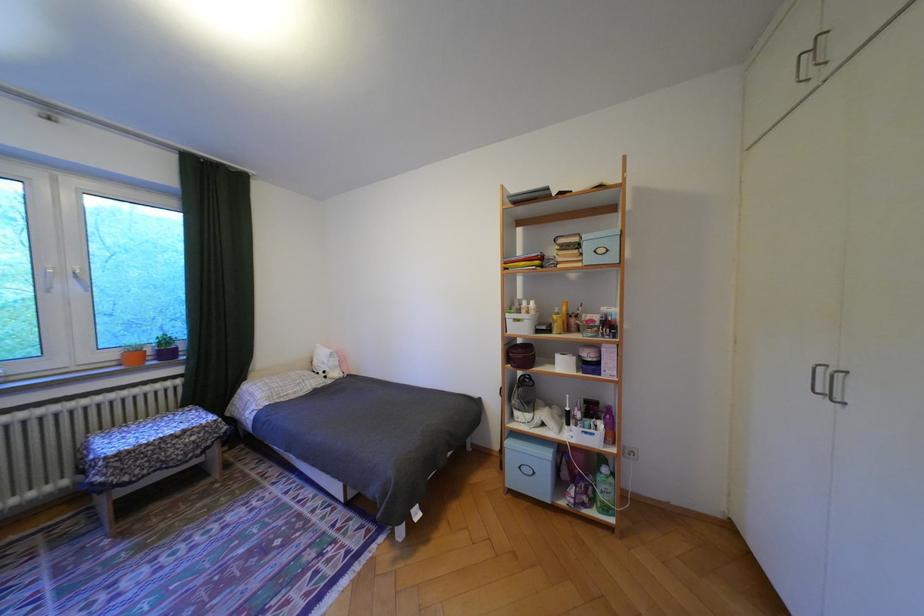
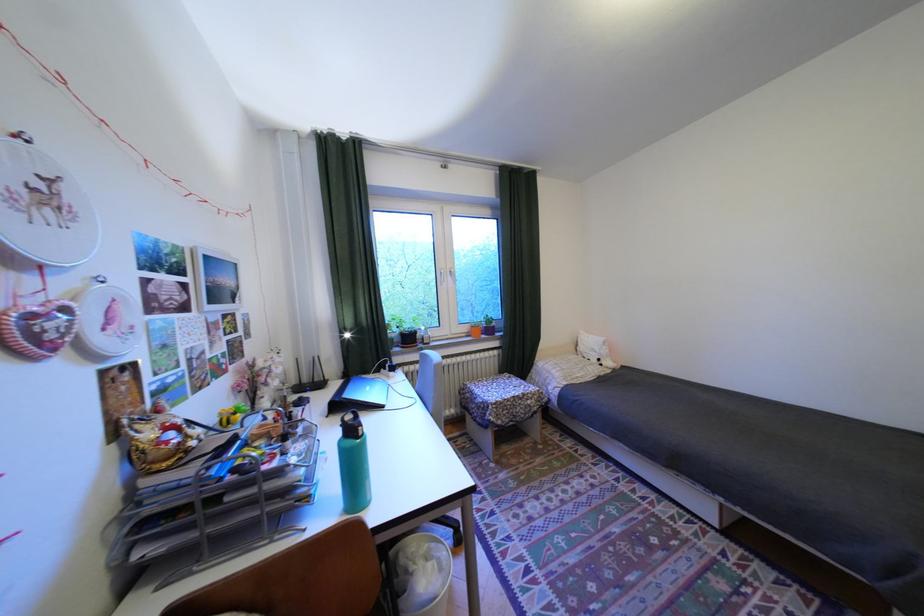
In the second image, find the point that corresponds to point 61,292 in the first image.

(454, 285)